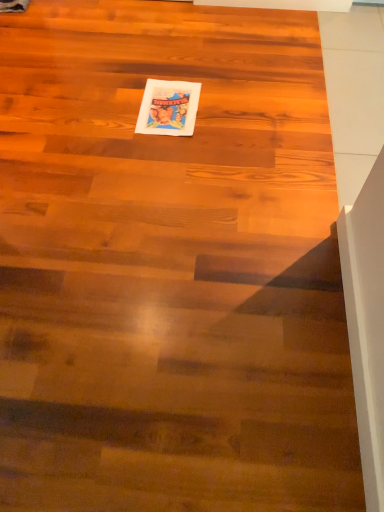
I want to click on free space in front of white paper book at center, so click(167, 155).